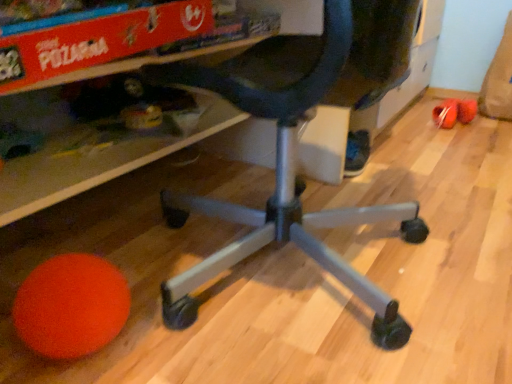
You are a GUI agent. You are given a task and a screenshot of the screen. Output one action in this format:
    pyautogui.click(x=<x>, y=<y>)
    Task: Click on the free space between orange matte ball at lower left and rubberized plastic ball at lower left
    
    Given the screenshot: What is the action you would take?
    tap(336, 193)